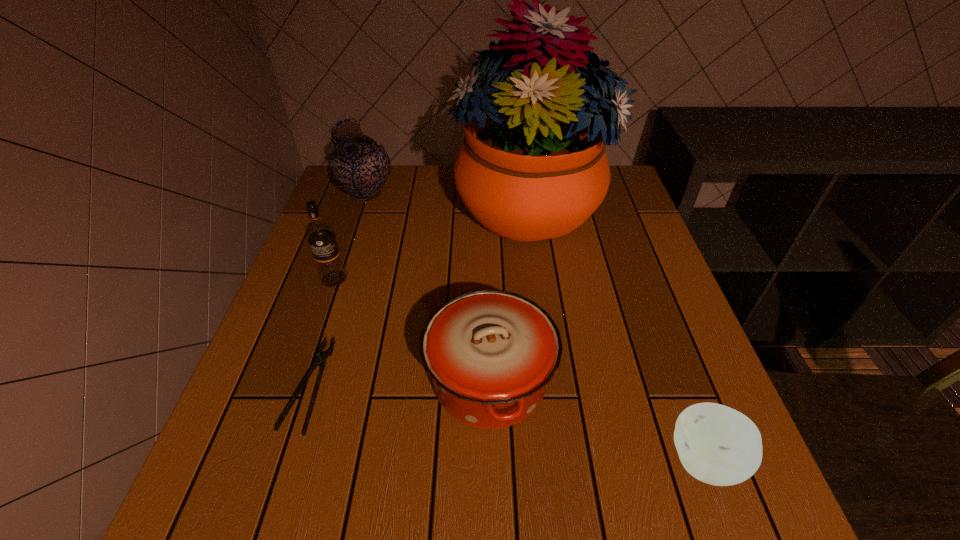
This screenshot has height=540, width=960. Find the location of `the tallest object`. the tallest object is located at coordinates (533, 166).

The height and width of the screenshot is (540, 960). In order to click on vodka in this screenshot , I will do `click(320, 234)`.

I want to click on pottery, so click(359, 166).

Locate an element on the screen. This screenshot has height=540, width=960. the third shortest object is located at coordinates (490, 353).

You are a GUI agent. You are given a task and a screenshot of the screen. Output one action in this format:
    pyautogui.click(x=<x>, y=<y>)
    Task: Click on the apple
    The width and height of the screenshot is (960, 540).
    Given the screenshot: What is the action you would take?
    pyautogui.click(x=718, y=445)

This screenshot has height=540, width=960. I want to click on tongs, so click(x=320, y=361).

At what (x,y) coordinates should I click in order to perform the action: click on vacant space situated 0.370m on the front of the flower arrangement. Please return your answer as a coordinate pair (x, y). Image resolution: width=960 pixels, height=540 pixels. Looking at the image, I should click on (552, 400).

This screenshot has height=540, width=960. What are the coordinates of `free space located on the label of the third farthest object` in the screenshot? It's located at (315, 333).

Find the location of a particular element. This screenshot has width=960, height=540. free space located on the right of the pottery is located at coordinates (470, 194).

At what (x,y) coordinates should I click in order to perform the action: click on free spot located on the right of the casserole. Please return your answer as a coordinate pair (x, y). This screenshot has height=540, width=960. Looking at the image, I should click on (623, 380).